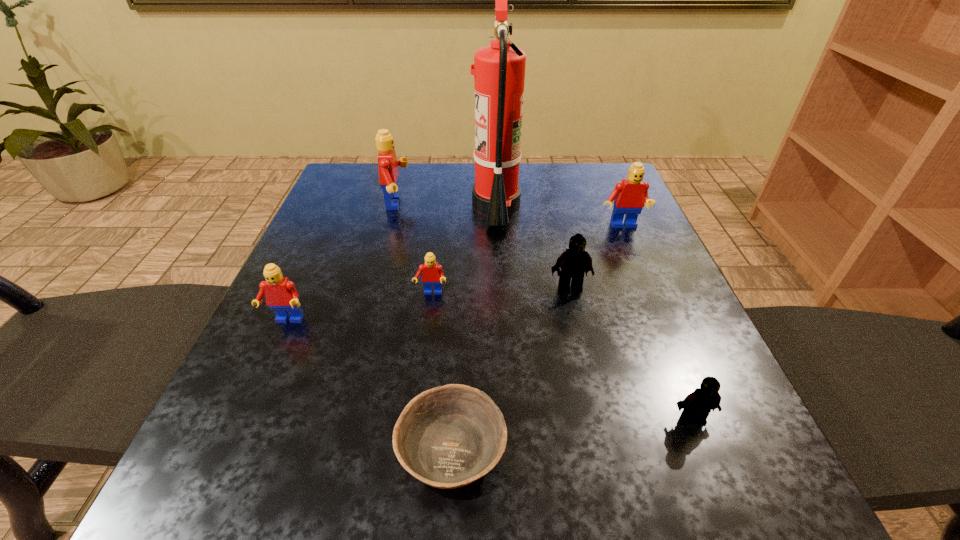
The image size is (960, 540). I want to click on unoccupied area between the nearer black Lego and the farthest red Lego, so click(x=544, y=311).

This screenshot has height=540, width=960. Find the location of `vacant area that lies between the third farthest red Lego and the shortest object`. vacant area that lies between the third farthest red Lego and the shortest object is located at coordinates (442, 372).

This screenshot has height=540, width=960. Identify the location of vacant space that is in between the fourth Lego from right to left and the fire extinguisher. (464, 250).

Identify the location of empty location between the shortest object and the biggest red Lego. The width and height of the screenshot is (960, 540). (424, 327).

Image resolution: width=960 pixels, height=540 pixels. I want to click on empty space that is in between the fifth nearest Lego and the red fire extinguisher, so click(x=559, y=217).

Identify the location of vacant area between the third red Lego from left to right and the third nearest red Lego. (526, 260).

I want to click on object that is the seventh closest to the red fire extinguisher, so click(697, 405).

The width and height of the screenshot is (960, 540). In order to click on object that is the nearest to the second biggest red Lego in this screenshot , I will do `click(499, 69)`.

Locate an element on the screen. Lego that stands as the fourth closest to the farther black Lego is located at coordinates (388, 165).

Locate which Lego is the fifth closest to the shortest object. Please provide its 2D coordinates. Your answer should be formatted as a tuple, i.e. [(x, y)], where the tuple contains the x and y coordinates of a point satisfying the conditions above.

[(629, 196)]